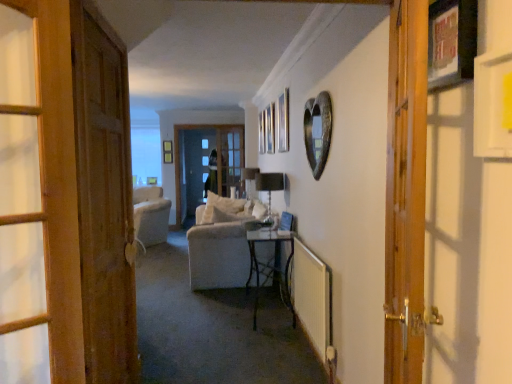
Question: Considering the relative positions of wooden picture frame at upper right, which appears as the first picture frame when viewed from the right, and wooden door at right, marked as the 1th door in a front-to-back arrangement, in the image provided, is wooden picture frame at upper right, which appears as the first picture frame when viewed from the right, in front of wooden door at right, marked as the 1th door in a front-to-back arrangement,?

Choices:
 (A) no
 (B) yes

Answer: (A)

Question: Is wooden picture frame at upper right, arranged as the 2th picture frame when viewed from the left, facing away from wooden door at right, marked as the 1th door in a front-to-back arrangement?

Choices:
 (A) yes
 (B) no

Answer: (B)

Question: Is wooden picture frame at upper right, which appears as the first picture frame when viewed from the right, shorter than wooden door at right, marked as the 1th door in a front-to-back arrangement?

Choices:
 (A) no
 (B) yes

Answer: (B)

Question: From a real-world perspective, is wooden picture frame at upper right, which ranks as the second picture frame in back-to-front order, over wooden door at right, acting as the 2th door starting from the left?

Choices:
 (A) no
 (B) yes

Answer: (B)

Question: Does wooden picture frame at upper right, which ranks as the second picture frame in back-to-front order, come behind wooden door at right, acting as the 2th door starting from the left?

Choices:
 (A) yes
 (B) no

Answer: (A)

Question: Which is correct: metallic heart at upper right, arranged as the first picture frame when viewed from the back, is inside wooden door at left, marked as the 1th door in a back-to-front arrangement, or outside of it?

Choices:
 (A) outside
 (B) inside

Answer: (A)

Question: Is metallic heart at upper right, which is counted as the 2th picture frame, starting from the right, wider or thinner than wooden door at left, marked as the 1th door in a back-to-front arrangement?

Choices:
 (A) thin
 (B) wide

Answer: (A)

Question: Is point (304, 107) closer or farther from the camera than point (97, 339)?

Choices:
 (A) farther
 (B) closer

Answer: (A)

Question: From the image's perspective, is metallic heart at upper right, arranged as the first picture frame when viewed from the back, positioned above or below wooden door at left, which appears as the first door when viewed from the left?

Choices:
 (A) above
 (B) below

Answer: (A)

Question: In terms of width, does wooden door at left, which appears as the first door when viewed from the left, look wider or thinner when compared to metallic heart at upper right, which is counted as the 2th picture frame, starting from the right?

Choices:
 (A) wide
 (B) thin

Answer: (A)

Question: Is wooden door at left, marked as the 1th door in a back-to-front arrangement, situated inside metallic heart at upper right, which is counted as the 2th picture frame, starting from the right, or outside?

Choices:
 (A) inside
 (B) outside

Answer: (B)

Question: From a real-world perspective, is wooden door at left, placed as the second door when sorted from front to back, above or below metallic heart at upper right, positioned as the 1th picture frame in left-to-right order?

Choices:
 (A) below
 (B) above

Answer: (A)

Question: In terms of height, does wooden door at left, which is the 2th door in right-to-left order, look taller or shorter compared to metallic heart at upper right, which is the 2th picture frame in front-to-back order?

Choices:
 (A) short
 (B) tall

Answer: (B)

Question: In the image, is wooden door at right, acting as the 2th door starting from the left, positioned in front of or behind wooden picture frame at upper right, which is counted as the first picture frame, starting from the front?

Choices:
 (A) front
 (B) behind

Answer: (A)

Question: Is wooden door at right, the 2th door viewed from the back, taller or shorter than wooden picture frame at upper right, which is counted as the first picture frame, starting from the front?

Choices:
 (A) tall
 (B) short

Answer: (A)